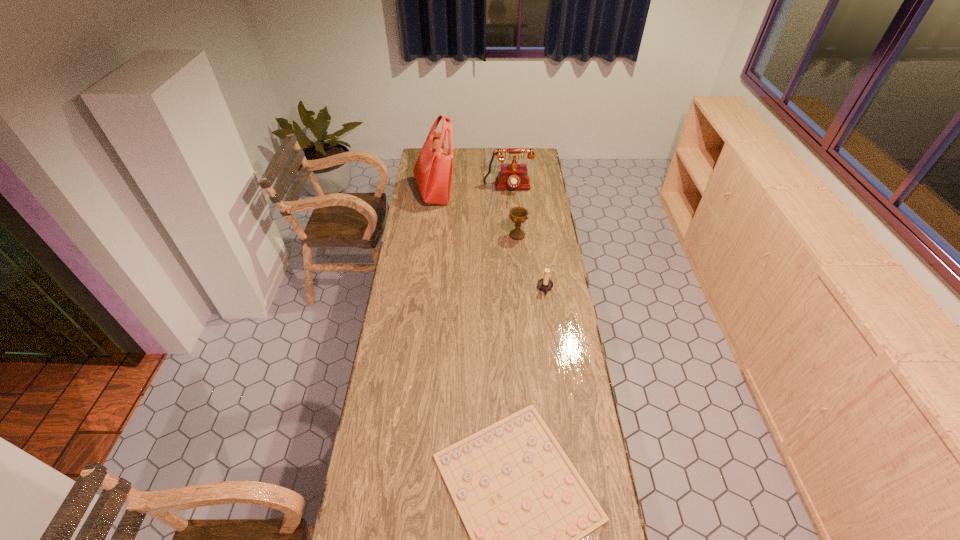
At what (x,y) coordinates should I click in order to perform the action: click on vacant space located on the wick of the candle holder. Please return your answer as a coordinate pair (x, y). The width and height of the screenshot is (960, 540). Looking at the image, I should click on (472, 289).

Locate an element on the screen. The image size is (960, 540). vacant space situated on the wick of the candle holder is located at coordinates tap(494, 289).

Identify the location of object at the left edge. (433, 171).

Locate an element on the screen. telephone present at the right edge is located at coordinates (513, 176).

Where is `chalice that is at the right edge`? This screenshot has height=540, width=960. chalice that is at the right edge is located at coordinates (518, 215).

In order to click on candle holder at the right edge in this screenshot , I will do `click(545, 284)`.

In the image, there is a desktop. Where is `free space at the far edge`? free space at the far edge is located at coordinates click(x=465, y=160).

Where is `vacant region at the left edge of the desktop`? vacant region at the left edge of the desktop is located at coordinates (403, 437).

At what (x,y) coordinates should I click in order to perform the action: click on free space at the right edge of the desktop. Please return your answer as a coordinate pair (x, y). Looking at the image, I should click on (544, 189).

Find the location of a particular element. This screenshot has width=960, height=540. vacant space at the far right corner of the desktop is located at coordinates (530, 168).